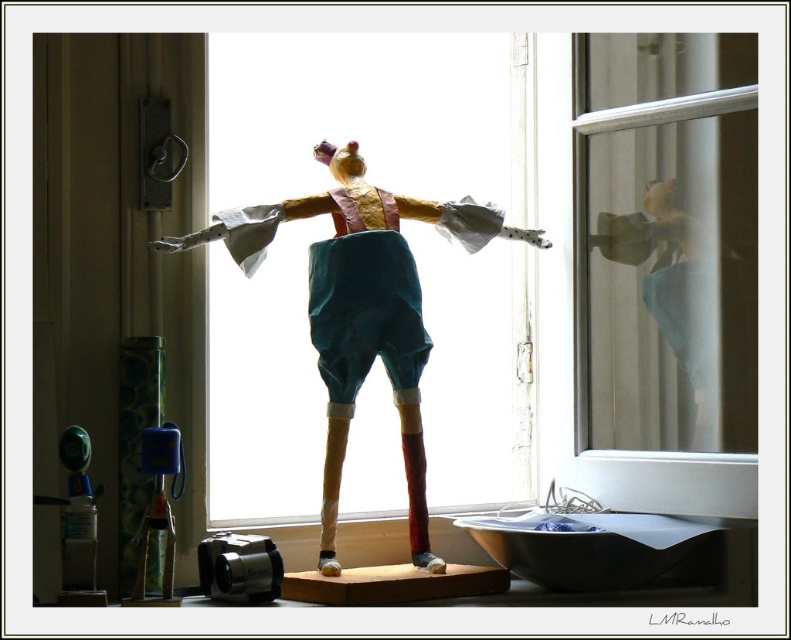
Does transparent glass window at center appear on the left side of blue plastic toy at left?

Incorrect, transparent glass window at center is not on the left side of blue plastic toy at left.

Who is more forward, (443, 448) or (163, 484)?

Point (163, 484) is in front.

I want to click on transparent glass window at center, so click(x=369, y=115).

Does translucent plastic bottle at lower left have a larger size compared to blue plastic toy at left?

Incorrect, translucent plastic bottle at lower left is not larger than blue plastic toy at left.

Image resolution: width=791 pixels, height=640 pixels. What do you see at coordinates (78, 524) in the screenshot? I see `translucent plastic bottle at lower left` at bounding box center [78, 524].

The image size is (791, 640). I want to click on translucent plastic bottle at lower left, so click(x=78, y=524).

The image size is (791, 640). Find the location of `translucent plastic bottle at lower left`. translucent plastic bottle at lower left is located at coordinates (78, 524).

Find the location of `transparent glass window at center`. transparent glass window at center is located at coordinates (369, 115).

Between transparent glass window at center and translucent plastic bottle at lower left, which one is positioned higher?

transparent glass window at center is above.

Is point (458, 150) positioned in front of point (74, 499)?

That is False.

The image size is (791, 640). In order to click on transparent glass window at center in this screenshot , I will do `click(369, 115)`.